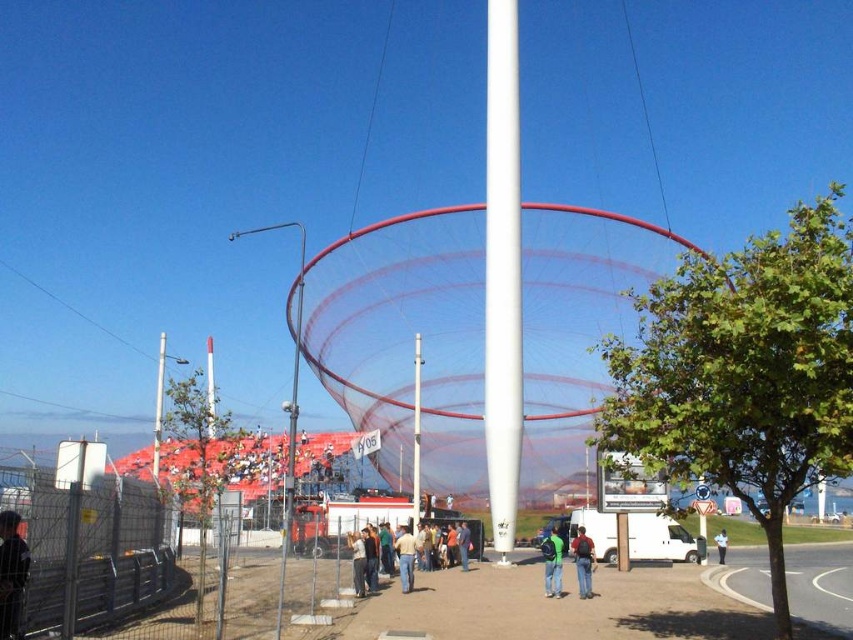
Question: Can you confirm if white glossy pole at center is smaller than denim jacket at center?

Choices:
 (A) yes
 (B) no

Answer: (B)

Question: Among these objects, which one is nearest to the camera?

Choices:
 (A) white fabric person at center
 (B) green fabric backpack at center
 (C) white matte mast at center
 (D) dark blue jacket at lower left

Answer: (D)

Question: Does tan fabric shirt at center have a lesser width compared to white fabric person at center?

Choices:
 (A) yes
 (B) no

Answer: (A)

Question: Among these points, which one is nearest to the camera?

Choices:
 (A) (395, 540)
 (B) (155, 413)

Answer: (A)

Question: Can you confirm if dark blue jacket at lower left is wider than tan fabric shirt at center?

Choices:
 (A) no
 (B) yes

Answer: (A)

Question: Which object is positioned closest to the dark blue jacket at lower left?

Choices:
 (A) tan fabric shirt at center
 (B) white fabric person at center

Answer: (A)